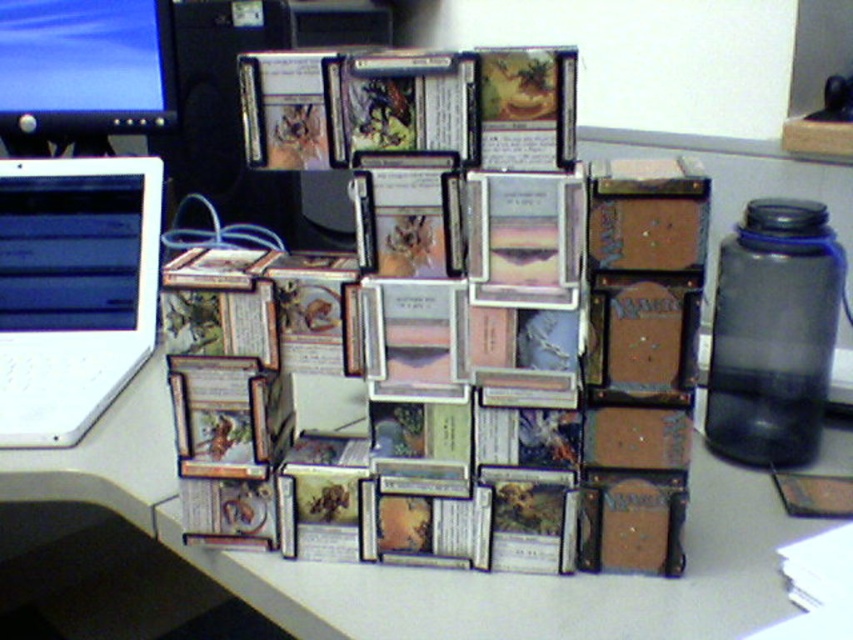
The image size is (853, 640). Describe the element at coordinates (434, 570) in the screenshot. I see `smooth gray table at center` at that location.

What do you see at coordinates (434, 570) in the screenshot? This screenshot has width=853, height=640. I see `smooth gray table at center` at bounding box center [434, 570].

At what (x,y) coordinates should I click in order to perform the action: click on smooth gray table at center. Please return your answer as a coordinate pair (x, y). Looking at the image, I should click on (434, 570).

Does point (146, 323) come in front of point (97, 257)?

Yes, it is.

Is white plastic laptop at left wider than matte black laptop at left?

Yes, white plastic laptop at left is wider than matte black laptop at left.

Does point (135, 296) come closer to viewer compared to point (137, 296)?

No, it is not.

What are the coordinates of `white plastic laptop at left` in the screenshot? It's located at (73, 291).

Does point (144, 465) lie in front of point (30, 193)?

Yes, it is in front of point (30, 193).

In the scene shown: Which is more to the right, smooth gray table at center or matte black laptop at left?

smooth gray table at center is more to the right.

Based on the photo, who is more distant from viewer, (703,538) or (102,212)?

The point (102,212) is more distant.

Where is `smooth gray table at center`? Image resolution: width=853 pixels, height=640 pixels. smooth gray table at center is located at coordinates (434, 570).